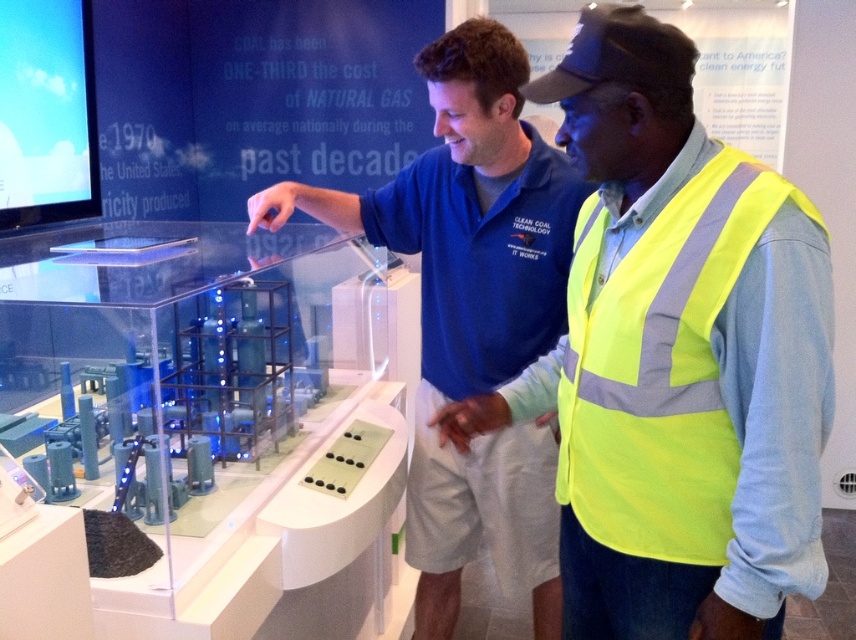
Question: Which point is farther to the camera?

Choices:
 (A) neon yellow safety vest at center
 (B) neon yellow reflective vest at right
 (C) blue shirt at center

Answer: (C)

Question: Can you confirm if blue shirt at center is smaller than neon yellow reflective vest at right?

Choices:
 (A) yes
 (B) no

Answer: (B)

Question: Which point is farther to the camera?

Choices:
 (A) (569, 172)
 (B) (684, 237)
 (C) (764, 340)

Answer: (A)

Question: Is neon yellow safety vest at center above blue shirt at center?

Choices:
 (A) no
 (B) yes

Answer: (B)

Question: Which point is farther from the camera taking this photo?

Choices:
 (A) click(727, 445)
 (B) click(397, 237)

Answer: (B)

Question: Is neon yellow safety vest at center positioned at the back of neon yellow reflective vest at right?

Choices:
 (A) yes
 (B) no

Answer: (B)